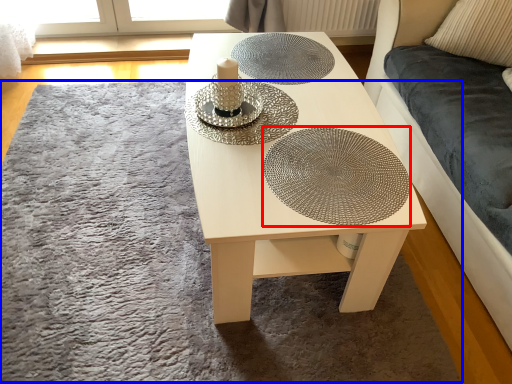
Question: Among these objects, which one is nearest to the camera, glass plate (highlighted by a red box) or mat (highlighted by a blue box)?

Choices:
 (A) glass plate
 (B) mat

Answer: (B)